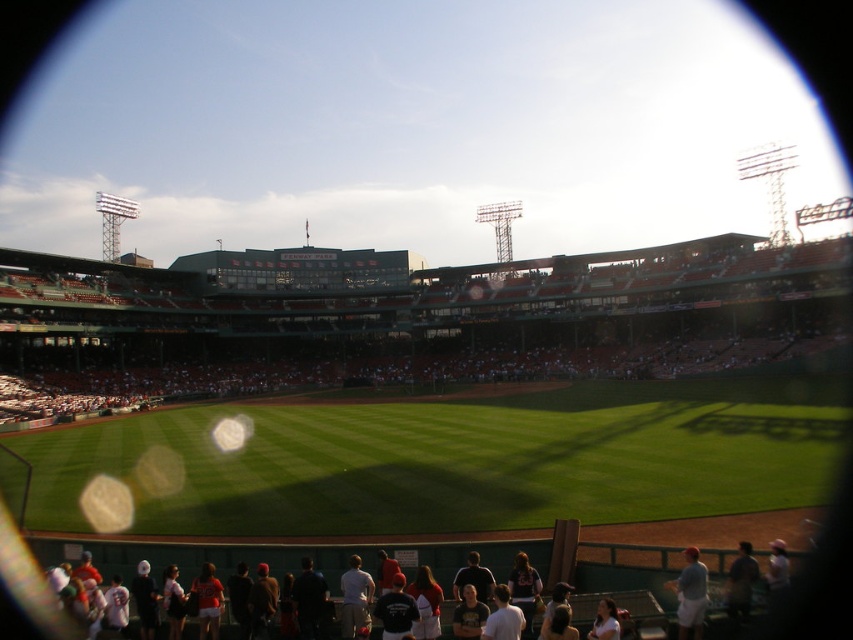
Question: From the image, what is the correct spatial relationship of white cotton shirt at center in relation to white cotton shirt at lower right?

Choices:
 (A) left
 (B) right

Answer: (A)

Question: Among these objects, which one is nearest to the camera?

Choices:
 (A) light blue fabric shirt at lower right
 (B) white cotton shirt at center
 (C) dark blue shirt at lower right
 (D) white cotton shirt at lower right

Answer: (D)

Question: Does light blue fabric shirt at lower right appear on the right side of white cotton shirt at center?

Choices:
 (A) no
 (B) yes

Answer: (B)

Question: Based on their relative distances, which object is farther from the white cotton shirt at lower right?

Choices:
 (A) white cotton shirt at center
 (B) dark blue shirt at lower right
 (C) light blue fabric shirt at lower right

Answer: (A)

Question: Is white cotton shirt at center to the right of dark blue shirt at lower right from the viewer's perspective?

Choices:
 (A) no
 (B) yes

Answer: (A)

Question: Which point appears closest to the camera in this image?

Choices:
 (A) (602, 636)
 (B) (746, 579)

Answer: (A)